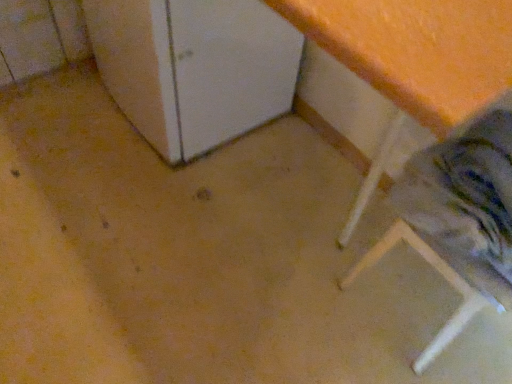
The image size is (512, 384). Describe the element at coordinates (439, 273) in the screenshot. I see `wooden step stool at lower right` at that location.

You are a GUI agent. You are given a task and a screenshot of the screen. Output one action in this format:
    pyautogui.click(x=<x>, y=<y>)
    Task: Click on the wooden step stool at lower right
    The height and width of the screenshot is (384, 512).
    Given the screenshot: What is the action you would take?
    pyautogui.click(x=439, y=273)

In order to click on white matte cabinet at upper left in this screenshot , I will do `click(194, 68)`.

What is the approximate height of white matte cabinet at upper left?

white matte cabinet at upper left is 62.09 centimeters in height.

What do you see at coordinates (194, 68) in the screenshot?
I see `white matte cabinet at upper left` at bounding box center [194, 68].

Locate an element on the screen. This screenshot has width=512, height=384. wooden step stool at lower right is located at coordinates (439, 273).

Visually, is white matte cabinet at upper left positioned to the left or to the right of wooden step stool at lower right?

From the image, it's evident that white matte cabinet at upper left is to the left of wooden step stool at lower right.

Between white matte cabinet at upper left and wooden step stool at lower right, which one is positioned in front?

wooden step stool at lower right is closer to the camera.

Is point (110, 37) behind point (412, 364)?

Yes, it is behind point (412, 364).

From the image's perspective, does white matte cabinet at upper left appear higher than wooden step stool at lower right?

Yes.

From the picture: From a real-world perspective, is white matte cabinet at upper left physically located above or below wooden step stool at lower right?

white matte cabinet at upper left is above wooden step stool at lower right.

Can you confirm if white matte cabinet at upper left is thinner than wooden step stool at lower right?

No.

Is white matte cabinet at upper left taller than wooden step stool at lower right?

Indeed, white matte cabinet at upper left has a greater height compared to wooden step stool at lower right.

Which of these two, white matte cabinet at upper left or wooden step stool at lower right, is smaller?

wooden step stool at lower right is smaller.

Is white matte cabinet at upper left inside or outside of wooden step stool at lower right?

white matte cabinet at upper left is not inside wooden step stool at lower right, it's outside.

Does white matte cabinet at upper left touch wooden step stool at lower right?

white matte cabinet at upper left and wooden step stool at lower right are clearly separated.

In the scene shown: Is white matte cabinet at upper left facing towards wooden step stool at lower right?

No, white matte cabinet at upper left is not facing towards wooden step stool at lower right.

How many degrees apart are the facing directions of white matte cabinet at upper left and wooden step stool at lower right?

They differ by 0.344 degrees in their facing directions.

Where is `leftover on the left of the wooden step stool at lower right`? The height and width of the screenshot is (384, 512). leftover on the left of the wooden step stool at lower right is located at coordinates (194, 68).

Considering the relative positions of wooden step stool at lower right and white matte cabinet at upper left in the image provided, is wooden step stool at lower right to the right of white matte cabinet at upper left from the viewer's perspective?

Yes.

Is wooden step stool at lower right in front of or behind white matte cabinet at upper left in the image?

Visually, wooden step stool at lower right is located in front of white matte cabinet at upper left.

Considering the positions of points (416, 370) and (244, 114), is point (416, 370) closer to camera compared to point (244, 114)?

Yes, point (416, 370) is in front of point (244, 114).

From the image's perspective, is wooden step stool at lower right below white matte cabinet at upper left?

Yes, from the image's perspective, wooden step stool at lower right is below white matte cabinet at upper left.

From a real-world perspective, who is located higher, wooden step stool at lower right or white matte cabinet at upper left?

white matte cabinet at upper left, from a real-world perspective.

Consider the image. Between wooden step stool at lower right and white matte cabinet at upper left, which one has larger width?

white matte cabinet at upper left is wider.

From their relative heights in the image, would you say wooden step stool at lower right is taller or shorter than white matte cabinet at upper left?

Considering their sizes, wooden step stool at lower right has less height than white matte cabinet at upper left.

Based on the photo, who is smaller, wooden step stool at lower right or white matte cabinet at upper left?

wooden step stool at lower right is smaller.

Is wooden step stool at lower right located outside white matte cabinet at upper left?

wooden step stool at lower right lies outside white matte cabinet at upper left's area.

Is wooden step stool at lower right far from white matte cabinet at upper left?

No, there isn't a large distance between wooden step stool at lower right and white matte cabinet at upper left.

Is white matte cabinet at upper left at the back of wooden step stool at lower right?

No, wooden step stool at lower right is not facing away from white matte cabinet at upper left.

Can you tell me how much wooden step stool at lower right and white matte cabinet at upper left differ in facing direction?

There is a 0.344-degree angle between the facing directions of wooden step stool at lower right and white matte cabinet at upper left.

In the image, there is a white matte cabinet at upper left. At what (x,y) coordinates should I click in order to perform the action: click on step stool below it (from the image's perspective). Please return your answer as a coordinate pair (x, y). This screenshot has height=384, width=512. Looking at the image, I should click on (439, 273).

Image resolution: width=512 pixels, height=384 pixels. In order to click on leftover that appears behind the wooden step stool at lower right in this screenshot , I will do `click(194, 68)`.

At what (x,y) coordinates should I click in order to perform the action: click on leftover that is above the wooden step stool at lower right (from a real-world perspective). Please return your answer as a coordinate pair (x, y). This screenshot has height=384, width=512. Looking at the image, I should click on (194, 68).